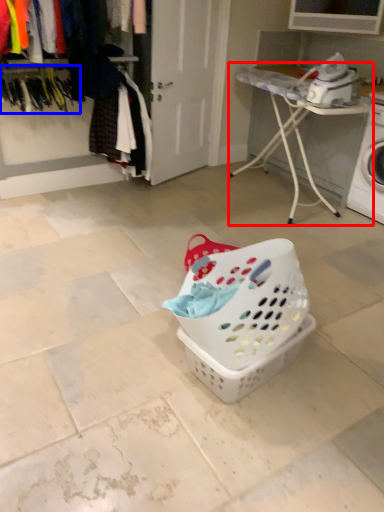
Question: Among these objects, which one is nearest to the camera, furniture (highlighted by a red box) or clothesline (highlighted by a blue box)?

Choices:
 (A) furniture
 (B) clothesline

Answer: (B)